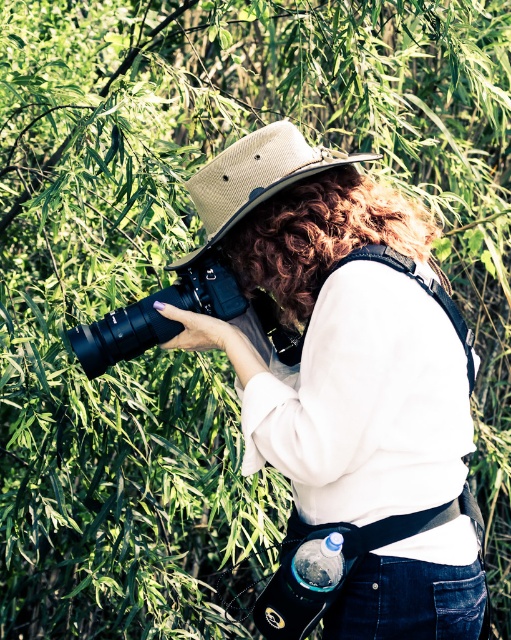
Question: Does beige canvas hat at center appear under black plastic camera at center?

Choices:
 (A) no
 (B) yes

Answer: (A)

Question: Which point appears farthest from the camera in this image?

Choices:
 (A) (84, 371)
 (B) (203, 216)

Answer: (B)

Question: Can you confirm if beige canvas hat at center is bigger than black plastic camera at center?

Choices:
 (A) yes
 (B) no

Answer: (A)

Question: Does beige canvas hat at center have a lesser width compared to black plastic camera at center?

Choices:
 (A) no
 (B) yes

Answer: (A)